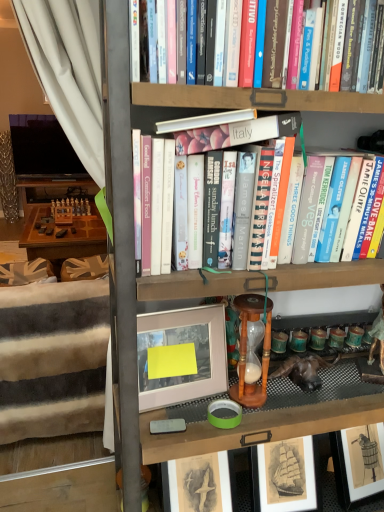
Question: Is wooden hourglass at center at the right side of hardcover books at center?

Choices:
 (A) yes
 (B) no

Answer: (A)

Question: Does wooden hourglass at center have a greater width compared to hardcover books at center?

Choices:
 (A) no
 (B) yes

Answer: (A)

Question: Is wooden hourglass at center bigger than hardcover books at center?

Choices:
 (A) yes
 (B) no

Answer: (B)

Question: From the image's perspective, is wooden hourglass at center beneath hardcover books at center?

Choices:
 (A) yes
 (B) no

Answer: (A)

Question: Considering the relative sizes of wooden hourglass at center and hardcover books at center in the image provided, is wooden hourglass at center taller than hardcover books at center?

Choices:
 (A) no
 (B) yes

Answer: (A)

Question: From a real-world perspective, is wooden hourglass at center beneath hardcover books at center?

Choices:
 (A) yes
 (B) no

Answer: (A)

Question: Is white fabric bed frame at left further to camera compared to wooden bookcase at center?

Choices:
 (A) yes
 (B) no

Answer: (A)

Question: From a real-world perspective, does white fabric bed frame at left sit lower than wooden bookcase at center?

Choices:
 (A) yes
 (B) no

Answer: (A)

Question: Can you confirm if white fabric bed frame at left is smaller than wooden bookcase at center?

Choices:
 (A) no
 (B) yes

Answer: (B)

Question: Can you confirm if white fabric bed frame at left is wider than wooden bookcase at center?

Choices:
 (A) no
 (B) yes

Answer: (B)

Question: Can we say white fabric bed frame at left lies outside wooden bookcase at center?

Choices:
 (A) yes
 (B) no

Answer: (A)

Question: Can wooden bookcase at center be found inside white fabric bed frame at left?

Choices:
 (A) yes
 (B) no

Answer: (B)

Question: Can you confirm if wooden hourglass at center is thinner than wooden bookcase at center?

Choices:
 (A) no
 (B) yes

Answer: (B)